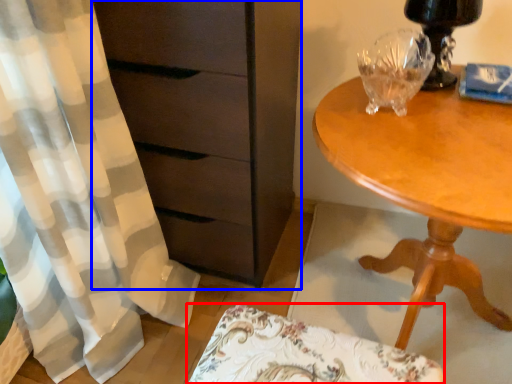
Question: Which object appears closest to the camera in this image, swivel chair (highlighted by a red box) or chest of drawers (highlighted by a blue box)?

Choices:
 (A) swivel chair
 (B) chest of drawers

Answer: (A)